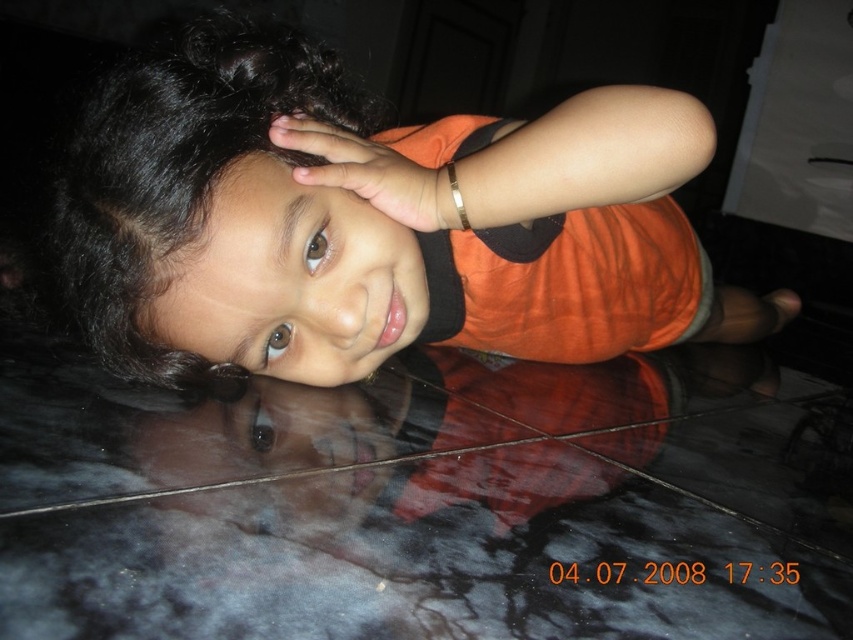
Question: Does black curly hair at center appear on the left side of smooth skin face at center?

Choices:
 (A) yes
 (B) no

Answer: (A)

Question: Is smooth skin face at center thinner than matte orange hand at upper center?

Choices:
 (A) no
 (B) yes

Answer: (A)

Question: Which point is closer to the camera taking this photo?

Choices:
 (A) (354, 176)
 (B) (326, 211)

Answer: (A)

Question: Which object appears farthest from the camera in this image?

Choices:
 (A) orange matte shirt at center
 (B) gold metallic bracelet at upper center
 (C) matte orange hand at upper center

Answer: (B)

Question: Does orange matte shirt at center have a greater width compared to gold metallic bracelet at upper center?

Choices:
 (A) no
 (B) yes

Answer: (B)

Question: Based on their relative distances, which object is nearer to the orange matte shirt at center?

Choices:
 (A) matte orange hand at upper center
 (B) smooth skin face at center
 (C) black curly hair at center
 (D) gold metallic bracelet at upper center

Answer: (C)